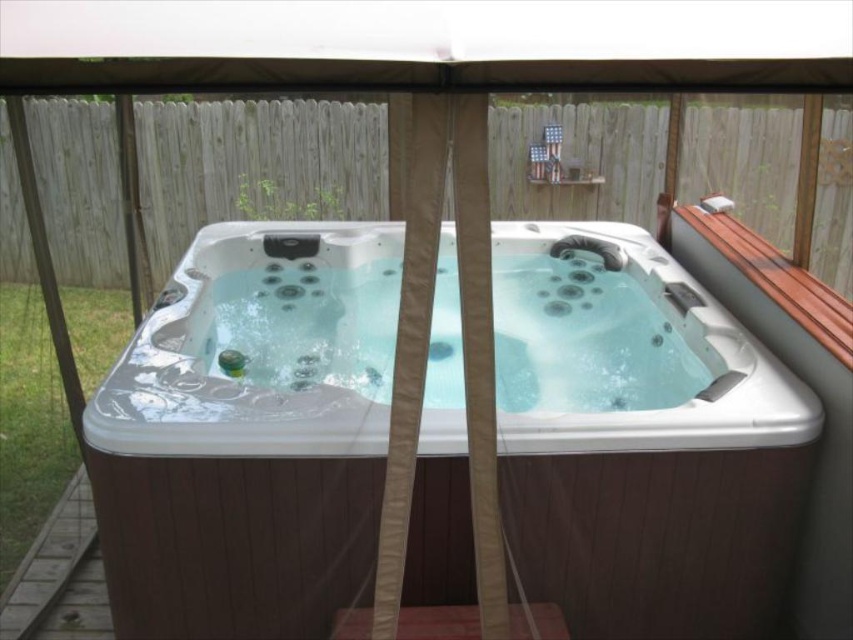
You are standing in the backyard and want to check the height difference between the white glossy hot tub at center and the brown wooden deck at lower left. Which one is taller?

The white glossy hot tub at center is taller than the brown wooden deck at lower left.